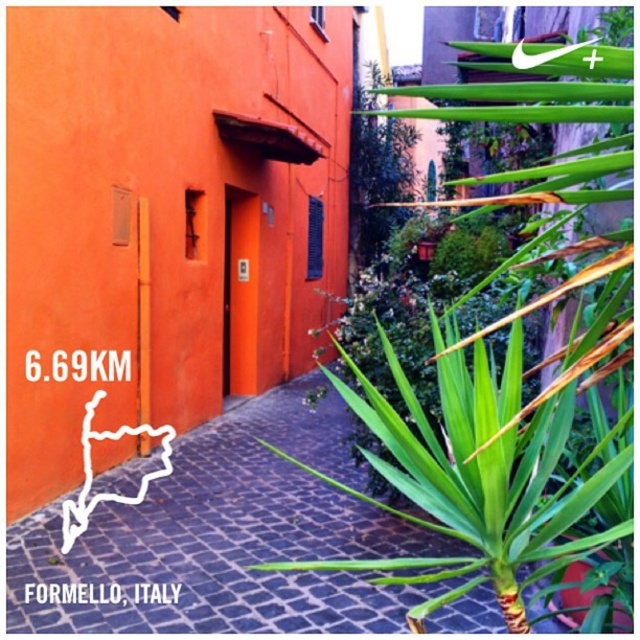
You are standing at the bottom left corner of the image where the text is located. You want to walk towards the green leafy plant at center right. In which direction should you move relative to the image?

The green leafy plant at center right is located at point 0.700 in the x coordinate and 0.772 in the y coordinate. Since you are at the bottom left corner, you should move towards the upper right direction to reach it.